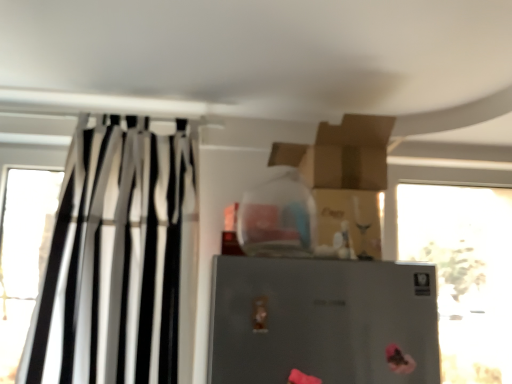
Where is `black/white striped curtain at left`? This screenshot has width=512, height=384. black/white striped curtain at left is located at coordinates (120, 260).

Image resolution: width=512 pixels, height=384 pixels. Describe the element at coordinates (120, 260) in the screenshot. I see `black/white striped curtain at left` at that location.

Looking at this image, measure the distance between transparent glass bottle at upper center and camera.

1.17 meters.

Describe the element at coordinates (276, 217) in the screenshot. I see `transparent glass bottle at upper center` at that location.

The height and width of the screenshot is (384, 512). Find the location of `black/white striped curtain at left`. black/white striped curtain at left is located at coordinates (120, 260).

Does transparent glass bottle at upper center appear on the right side of transparent glass window at right?

No.

I want to click on bottle that is above the transparent glass window at right (from a real-world perspective), so click(276, 217).

How different are the orientations of transparent glass bottle at upper center and transparent glass window at right in degrees?

The angle between the facing direction of transparent glass bottle at upper center and the facing direction of transparent glass window at right is 0.74 degrees.

From a real-world perspective, is transparent glass bottle at upper center over transparent glass window at right?

Indeed, from a real-world perspective, transparent glass bottle at upper center stands above transparent glass window at right.

From a real-world perspective, is satin silver refrigerator at center positioned above or below transparent glass window at right?

satin silver refrigerator at center is situated lower than transparent glass window at right in the real world.

Does satin silver refrigerator at center have a larger size compared to transparent glass window at right?

Actually, satin silver refrigerator at center might be smaller than transparent glass window at right.

Can you confirm if transparent glass bottle at upper center is positioned to the left of satin silver refrigerator at center?

Indeed, transparent glass bottle at upper center is positioned on the left side of satin silver refrigerator at center.

Which of these two, transparent glass bottle at upper center or satin silver refrigerator at center, stands taller?

satin silver refrigerator at center is taller.

In the image, is transparent glass bottle at upper center positioned in front of or behind satin silver refrigerator at center?

Clearly, transparent glass bottle at upper center is behind satin silver refrigerator at center.

From a real-world perspective, does transparent glass bottle at upper center sit lower than satin silver refrigerator at center?

Actually, transparent glass bottle at upper center is physically above satin silver refrigerator at center in the real world.

From the image's perspective, does transparent glass window at right appear lower than satin silver refrigerator at center?

Yes, from the image's perspective, transparent glass window at right is below satin silver refrigerator at center.

Would you consider transparent glass window at right to be distant from satin silver refrigerator at center?

Yes.

Which point is more distant from viewer, (473, 243) or (307, 274)?

Positioned behind is point (473, 243).

Based on the photo, from a real-world perspective, relative to satin silver refrigerator at center, is transparent glass window at right vertically above or below?

In terms of real-world spatial position, transparent glass window at right is above satin silver refrigerator at center.

Locate an element on the screen. This screenshot has width=512, height=384. curtain that appears above the satin silver refrigerator at center (from the image's perspective) is located at coordinates (120, 260).

From the picture: Is satin silver refrigerator at center facing away from black/white striped curtain at left?

No.

Between satin silver refrigerator at center and black/white striped curtain at left, which one has smaller size?

satin silver refrigerator at center.

From a real-world perspective, is satin silver refrigerator at center positioned above or below black/white striped curtain at left?

In terms of real-world spatial position, satin silver refrigerator at center is below black/white striped curtain at left.

This screenshot has height=384, width=512. Find the location of `curtain beneath the transparent glass bottle at upper center (from a real-world perspective)`. curtain beneath the transparent glass bottle at upper center (from a real-world perspective) is located at coordinates (120, 260).

Can you confirm if black/white striped curtain at left is taller than transparent glass bottle at upper center?

Correct, black/white striped curtain at left is much taller as transparent glass bottle at upper center.

Which object is further away from the camera taking this photo, black/white striped curtain at left or transparent glass bottle at upper center?

black/white striped curtain at left.

In the scene shown: Is black/white striped curtain at left placed right next to transparent glass bottle at upper center?

No, black/white striped curtain at left is not in contact with transparent glass bottle at upper center.

Is black/white striped curtain at left positioned in front of satin silver refrigerator at center?

No, it is not.

From the image's perspective, who appears lower, black/white striped curtain at left or satin silver refrigerator at center?

satin silver refrigerator at center, from the image's perspective.

In the scene shown: Is black/white striped curtain at left looking in the opposite direction of satin silver refrigerator at center?

No, black/white striped curtain at left is not facing the opposite direction of satin silver refrigerator at center.

From a real-world perspective, which is physically below, black/white striped curtain at left or satin silver refrigerator at center?

From a 3D spatial view, satin silver refrigerator at center is below.

Identify the location of bottle above the transparent glass window at right (from the image's perspective). (276, 217).

Locate an element on the screen. window to the right of satin silver refrigerator at center is located at coordinates (465, 273).

When comparing their distances from satin silver refrigerator at center, does black/white striped curtain at left or transparent glass window at right seem closer?

black/white striped curtain at left lies closer to satin silver refrigerator at center than the other object.

Based on their spatial positions, is transparent glass bottle at upper center or transparent glass window at right closer to black/white striped curtain at left?

transparent glass bottle at upper center.

Considering their positions, is black/white striped curtain at left positioned further to transparent glass window at right than transparent glass bottle at upper center?

black/white striped curtain at left is positioned further to the anchor transparent glass window at right.

From the image, which object appears to be nearer to transparent glass window at right, transparent glass bottle at upper center or black/white striped curtain at left?

transparent glass bottle at upper center lies closer to transparent glass window at right than the other object.

Based on their spatial positions, is black/white striped curtain at left or satin silver refrigerator at center closer to transparent glass bottle at upper center?

satin silver refrigerator at center.

From the image, which object appears to be farther from black/white striped curtain at left, satin silver refrigerator at center or transparent glass bottle at upper center?

satin silver refrigerator at center.

Based on their spatial positions, is transparent glass window at right or transparent glass bottle at upper center further from black/white striped curtain at left?

transparent glass window at right lies further to black/white striped curtain at left than the other object.

When comparing their distances from satin silver refrigerator at center, does transparent glass bottle at upper center or transparent glass window at right seem further?

transparent glass window at right is further to satin silver refrigerator at center.

Identify the location of bottle between black/white striped curtain at left and satin silver refrigerator at center. (276, 217).

Locate an element on the screen. Image resolution: width=512 pixels, height=384 pixels. refrigerator between transparent glass bottle at upper center and transparent glass window at right in the horizontal direction is located at coordinates (323, 321).

The height and width of the screenshot is (384, 512). In order to click on refrigerator between black/white striped curtain at left and transparent glass window at right in the horizontal direction in this screenshot , I will do `click(323, 321)`.

Locate an element on the screen. The height and width of the screenshot is (384, 512). bottle situated between black/white striped curtain at left and transparent glass window at right from left to right is located at coordinates coord(276,217).